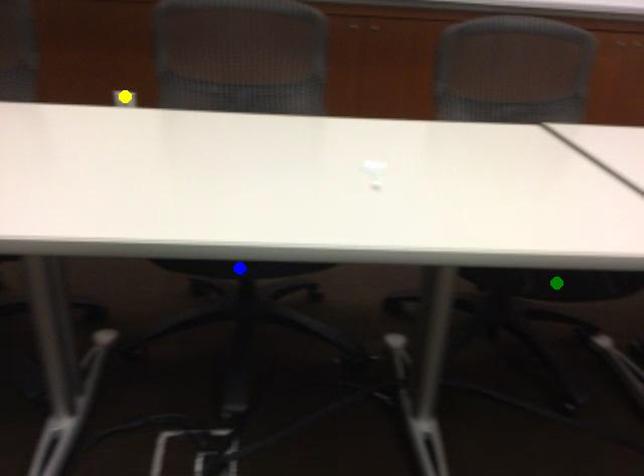
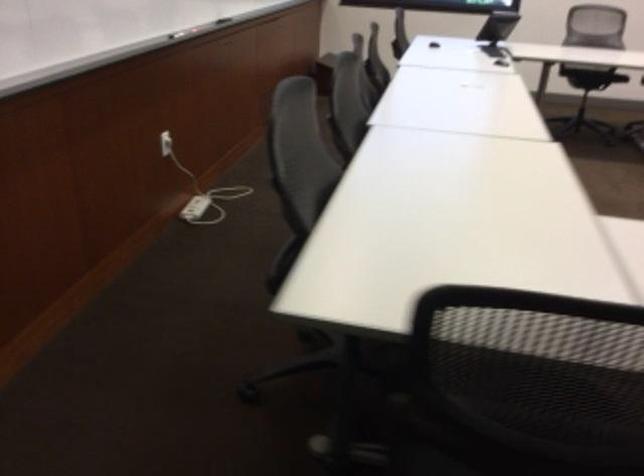
I am providing you with two images of the same scene from different viewpoints. Three points are marked in image1. Which point corresponds to a part or object that is occluded in image2?In image1, three points are marked. Which of them correspond to a part or object that is occluded in image2?Among the three points shown in image1, which one corresponds to a part or object that is no longer visible due to occlusion in image2?

yellow point, green point, blue point cannot be seen in image2.